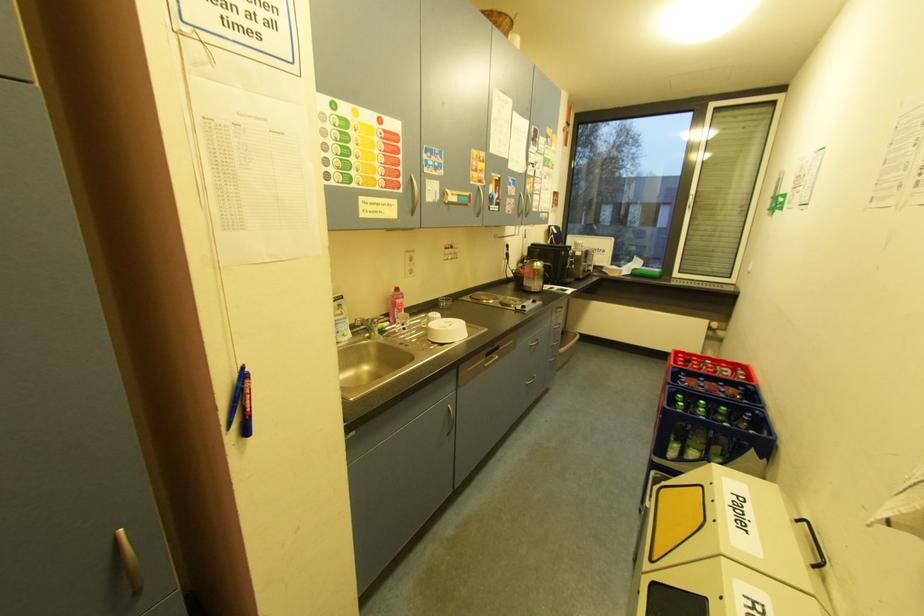
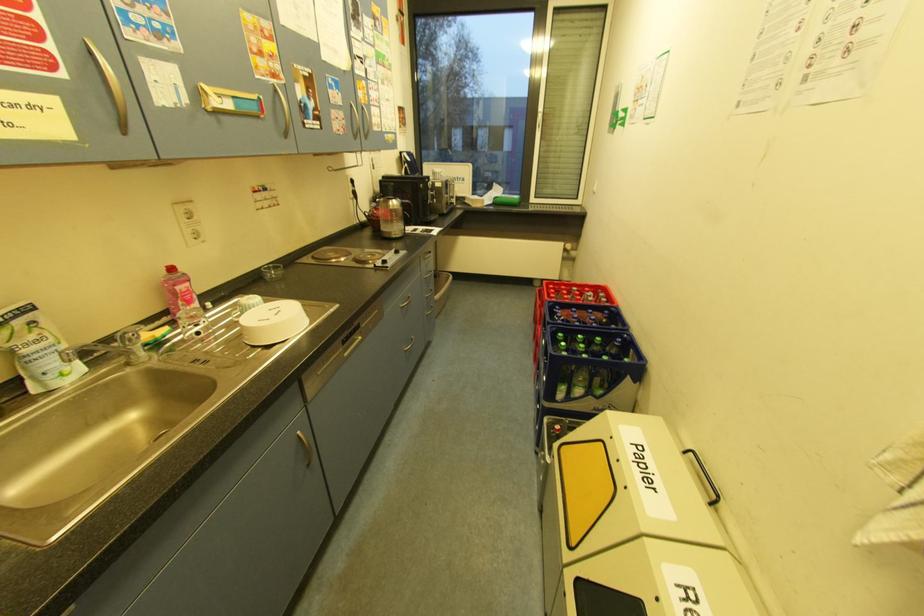
Question: The images are taken continuously from a first-person perspective. In which direction is your viewpoint rotating?

Choices:
 (A) Left
 (B) Right
 (C) Up
 (D) Down

Answer: (B)